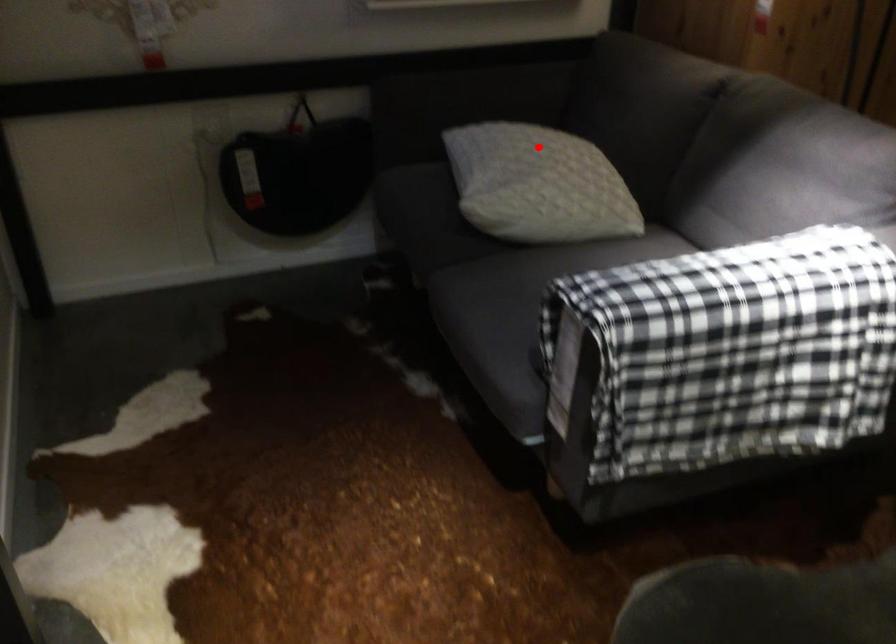
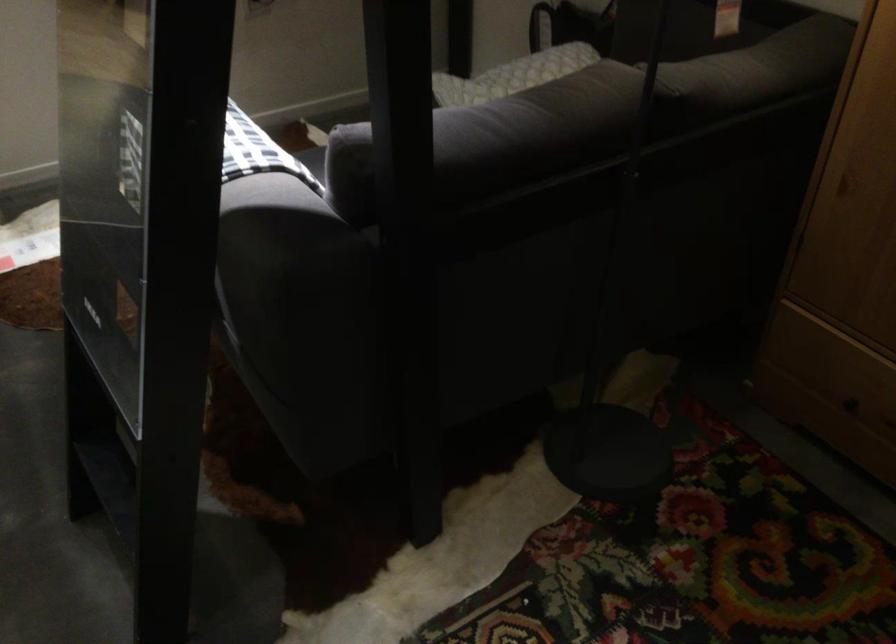
In the second image, find the point that corresponds to the highlighted location in the first image.

(528, 68)